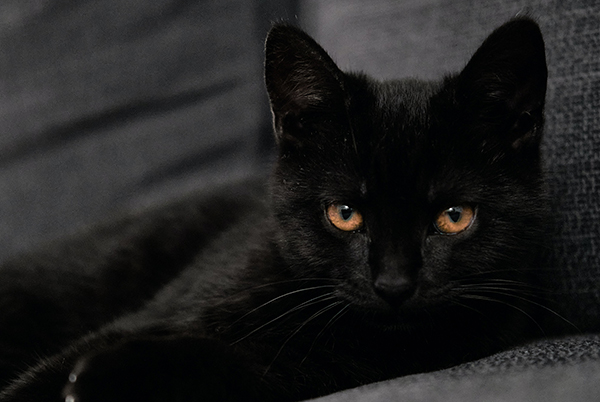
I want to click on crease in fabric, so click(131, 110), click(198, 165).